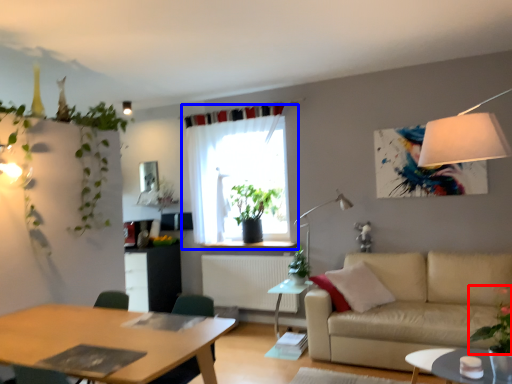
Question: Among these objects, which one is nearest to the camera, plant (highlighted by a red box) or curtain (highlighted by a blue box)?

Choices:
 (A) plant
 (B) curtain

Answer: (A)